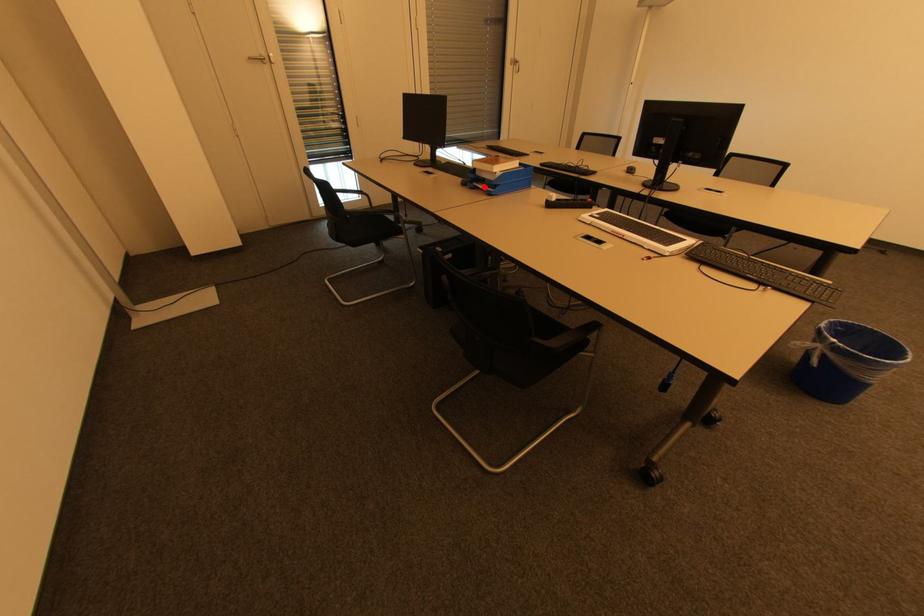
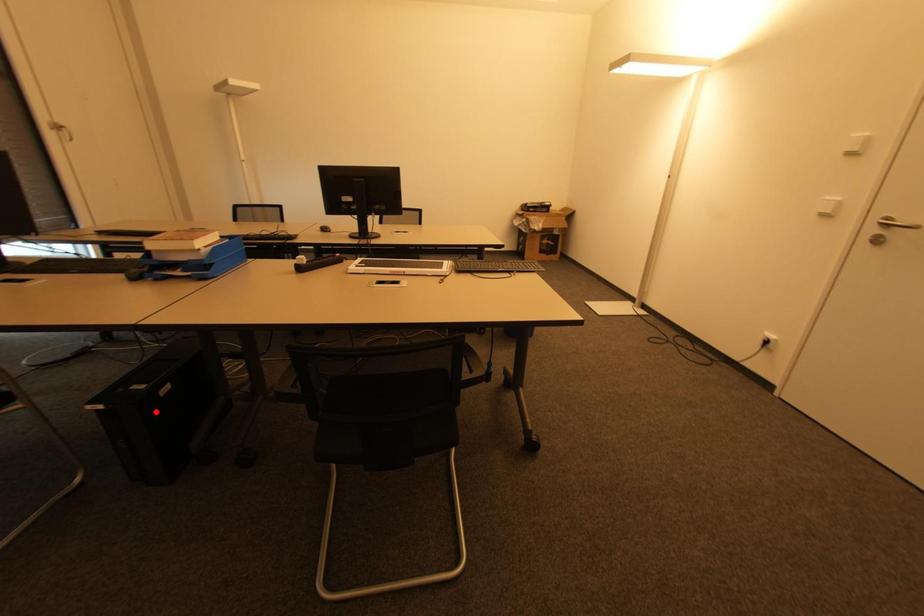
I am providing you with two images of the same scene from different viewpoints. A red point is marked on the first image and another point is marked on the second image. Is the marked point in image1 the same physical position as the marked point in image2?

No